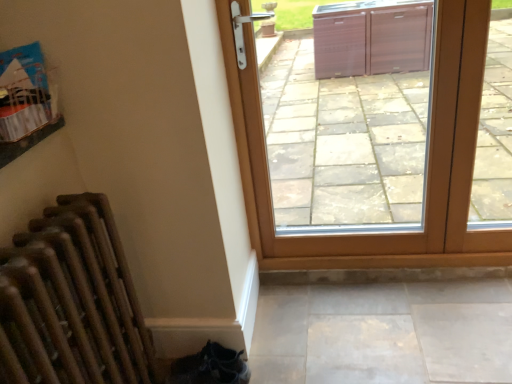
Question: Is brown wooden door at center oriented towards wooden radiator at lower left?

Choices:
 (A) yes
 (B) no

Answer: (B)

Question: Can you confirm if brown wooden door at center is positioned to the right of wooden radiator at lower left?

Choices:
 (A) yes
 (B) no

Answer: (A)

Question: Is brown wooden door at center positioned behind wooden radiator at lower left?

Choices:
 (A) no
 (B) yes

Answer: (B)

Question: From a real-world perspective, is brown wooden door at center below wooden radiator at lower left?

Choices:
 (A) no
 (B) yes

Answer: (A)

Question: Considering the relative positions of brown wooden door at center and wooden radiator at lower left in the image provided, is brown wooden door at center to the left of wooden radiator at lower left from the viewer's perspective?

Choices:
 (A) no
 (B) yes

Answer: (A)

Question: Would you say brown wooden door at center is outside wooden radiator at lower left?

Choices:
 (A) no
 (B) yes

Answer: (B)

Question: Can you confirm if wooden radiator at lower left is thinner than brown wooden door at center?

Choices:
 (A) yes
 (B) no

Answer: (B)

Question: Considering the relative sizes of wooden radiator at lower left and brown wooden door at center in the image provided, is wooden radiator at lower left taller than brown wooden door at center?

Choices:
 (A) no
 (B) yes

Answer: (A)

Question: Does wooden radiator at lower left have a larger size compared to brown wooden door at center?

Choices:
 (A) yes
 (B) no

Answer: (B)

Question: Is wooden radiator at lower left positioned with its back to brown wooden door at center?

Choices:
 (A) no
 (B) yes

Answer: (A)

Question: Does wooden radiator at lower left have a smaller size compared to brown wooden door at center?

Choices:
 (A) no
 (B) yes

Answer: (B)

Question: From a real-world perspective, is wooden radiator at lower left on brown wooden door at center?

Choices:
 (A) no
 (B) yes

Answer: (A)

Question: Is point (497, 251) closer or farther from the camera than point (59, 302)?

Choices:
 (A) closer
 (B) farther

Answer: (B)